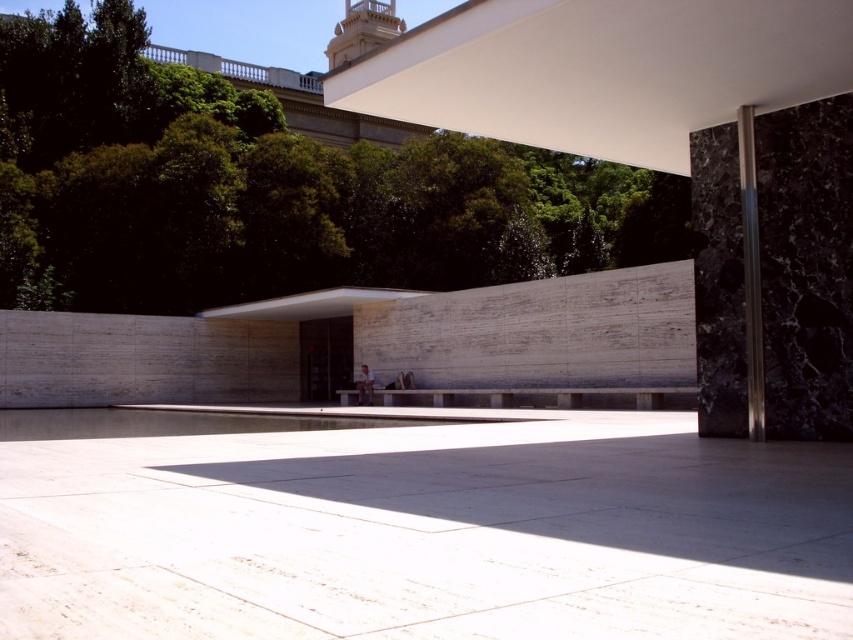
Can you confirm if green leafy tree at upper center is taller than polished silver pole at right?

Correct, green leafy tree at upper center is much taller as polished silver pole at right.

Who is more forward, (248,225) or (752,371)?

Point (752,371)

This screenshot has width=853, height=640. Describe the element at coordinates (270, 186) in the screenshot. I see `green leafy tree at upper center` at that location.

Where is `green leafy tree at upper center`? Image resolution: width=853 pixels, height=640 pixels. green leafy tree at upper center is located at coordinates (270, 186).

Does white polished concrete at center have a larger size compared to green leafy tree at upper center?

No, white polished concrete at center is not bigger than green leafy tree at upper center.

Is point (364, 618) positioned after point (468, 212)?

No, it is not.

Identify the location of white polished concrete at center. (427, 534).

Does white polished concrete at center lie behind polished silver pole at right?

No, it is in front of polished silver pole at right.

Does white polished concrete at center have a greater height compared to polished silver pole at right?

Incorrect, white polished concrete at center's height is not larger of polished silver pole at right's.

You are a GUI agent. You are given a task and a screenshot of the screen. Output one action in this format:
    pyautogui.click(x=<x>, y=<y>)
    Task: Click on the white polished concrete at center
    Image resolution: width=853 pixels, height=640 pixels.
    Given the screenshot: What is the action you would take?
    pyautogui.click(x=427, y=534)